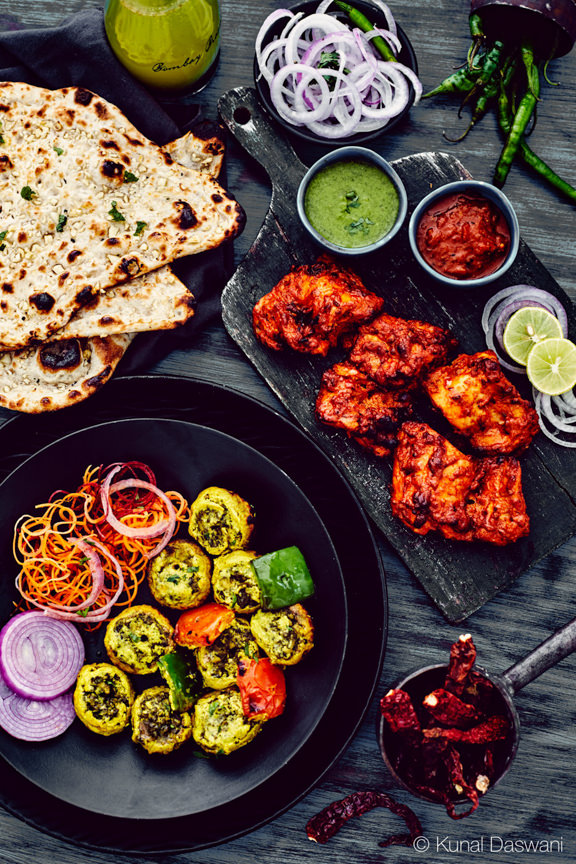
Locate an element on the screen. Image resolution: width=576 pixels, height=864 pixels. napkin is located at coordinates pyautogui.click(x=88, y=29).